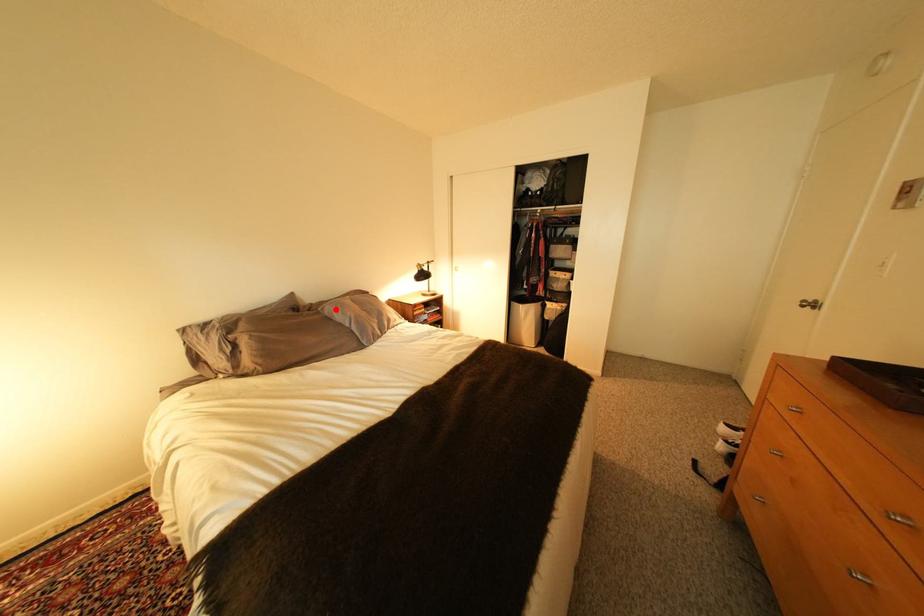
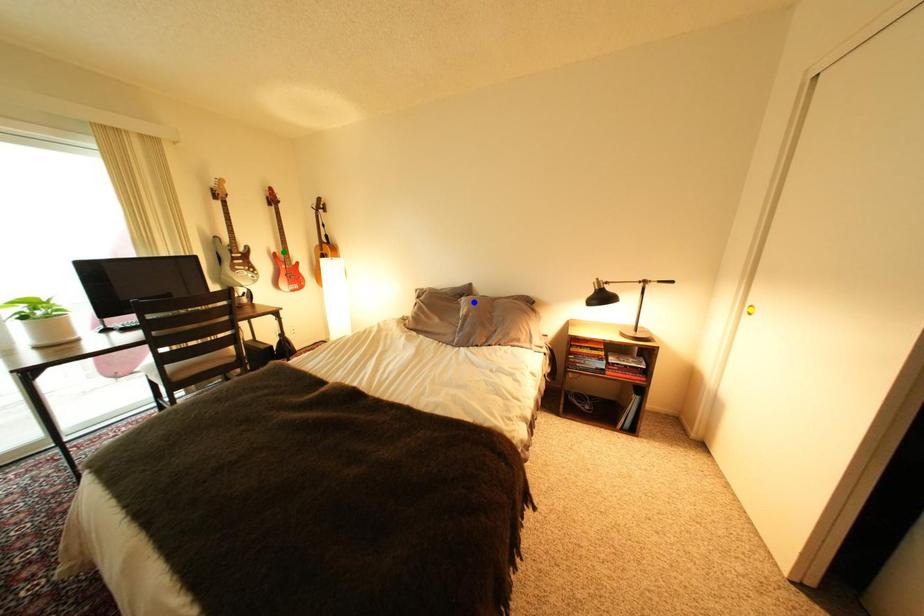
Question: I am providing you with two images of the same scene from different viewpoints. A red point is marked on the first image. You are given multiple points on the second image. Which point in image 2 represents the same 3d spot as the red point in image 1?

Choices:
 (A) blue point
 (B) green point
 (C) yellow point

Answer: (A)